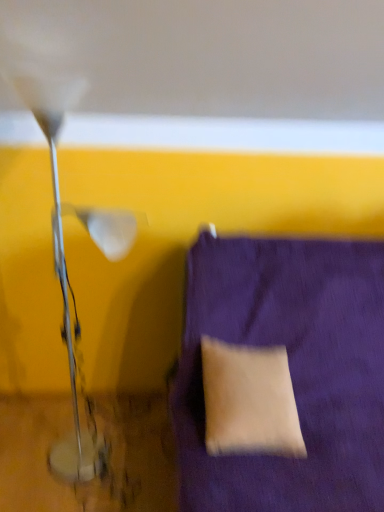
At what (x,y) coordinates should I click in order to perform the action: click on beige fabric pillow at lower right. Please return your answer as a coordinate pair (x, y). The image size is (384, 512). Looking at the image, I should click on (249, 401).

Considering their positions, is beige fabric pillow at lower right located in front of or behind purple fabric cushion at lower right?

beige fabric pillow at lower right is positioned farther from the viewer than purple fabric cushion at lower right.

Does point (225, 393) appear closer or farther from the camera than point (308, 408)?

Point (225, 393).

Which of these two, beige fabric pillow at lower right or purple fabric cushion at lower right, is smaller?

Smaller between the two is beige fabric pillow at lower right.

Between purple fabric cushion at lower right and beige fabric pillow at lower right, which one has smaller width?

beige fabric pillow at lower right.

Image resolution: width=384 pixels, height=512 pixels. Identify the location of furniture on the right of the beige fabric pillow at lower right. (290, 371).

Is purple fabric cushion at lower right bigger than beige fabric pillow at lower right?

Indeed, purple fabric cushion at lower right has a larger size compared to beige fabric pillow at lower right.

In the scene shown: From the image's perspective, which object appears higher, purple fabric cushion at lower right or beige fabric pillow at lower right?

beige fabric pillow at lower right, from the image's perspective.

From the picture: How much distance is there between purple fabric cushion at lower right and metallic silver lamp at left?

A distance of 28.29 inches exists between purple fabric cushion at lower right and metallic silver lamp at left.

Do you think purple fabric cushion at lower right is within metallic silver lamp at left, or outside of it?

purple fabric cushion at lower right is not inside metallic silver lamp at left, it's outside.

You are a GUI agent. You are given a task and a screenshot of the screen. Output one action in this format:
    pyautogui.click(x=<x>, y=<y>)
    Task: Click on the lamp located behind the purple fabric cushion at lower right
    Image resolution: width=384 pixels, height=512 pixels.
    Given the screenshot: What is the action you would take?
    pyautogui.click(x=58, y=178)

Consider the image. From the image's perspective, is purple fabric cushion at lower right above metallic silver lamp at left?

No, from the image's perspective, purple fabric cushion at lower right is not above metallic silver lamp at left.

From a real-world perspective, is metallic silver lamp at left positioned above or below purple fabric cushion at lower right?

Clearly, from a real-world perspective, metallic silver lamp at left is above purple fabric cushion at lower right.

Consider the image. Which of these two, metallic silver lamp at left or purple fabric cushion at lower right, is thinner?

With smaller width is metallic silver lamp at left.

How different are the orientations of metallic silver lamp at left and purple fabric cushion at lower right in degrees?

0.32 degrees.

Which is more to the right, metallic silver lamp at left or purple fabric cushion at lower right?

purple fabric cushion at lower right is more to the right.

In the scene shown: Does metallic silver lamp at left have a greater width compared to beige fabric pillow at lower right?

Correct, the width of metallic silver lamp at left exceeds that of beige fabric pillow at lower right.

Is metallic silver lamp at left positioned far away from beige fabric pillow at lower right?

No, metallic silver lamp at left is not far away from beige fabric pillow at lower right.

Is metallic silver lamp at left looking in the opposite direction of beige fabric pillow at lower right?

No, metallic silver lamp at left is not facing the opposite direction of beige fabric pillow at lower right.

Which is farther from the camera, (71, 442) or (268, 369)?

The point (71, 442) is behind.

Looking at their sizes, would you say beige fabric pillow at lower right is wider or thinner than metallic silver lamp at left?

beige fabric pillow at lower right is thinner than metallic silver lamp at left.

From the image's perspective, does beige fabric pillow at lower right appear lower than metallic silver lamp at left?

Correct, beige fabric pillow at lower right appears lower than metallic silver lamp at left in the image.

Do you think beige fabric pillow at lower right is within metallic silver lamp at left, or outside of it?

beige fabric pillow at lower right cannot be found inside metallic silver lamp at left.

Between beige fabric pillow at lower right and metallic silver lamp at left, which one has more height?

Standing taller between the two is metallic silver lamp at left.

Where is `pillow that is above the purple fabric cushion at lower right (from the image's perspective)`? pillow that is above the purple fabric cushion at lower right (from the image's perspective) is located at coordinates (249, 401).

Locate an element on the screen. This screenshot has height=512, width=384. pillow on the left of purple fabric cushion at lower right is located at coordinates (249, 401).

Estimate the real-world distances between objects in this image. Which object is further from metallic silver lamp at left, beige fabric pillow at lower right or purple fabric cushion at lower right?

purple fabric cushion at lower right is positioned further to the anchor metallic silver lamp at left.

Which object lies nearer to the anchor point beige fabric pillow at lower right, purple fabric cushion at lower right or metallic silver lamp at left?

The object closer to beige fabric pillow at lower right is purple fabric cushion at lower right.

Considering their positions, is metallic silver lamp at left positioned closer to beige fabric pillow at lower right than purple fabric cushion at lower right?

Among the two, purple fabric cushion at lower right is located nearer to beige fabric pillow at lower right.

Based on their spatial positions, is purple fabric cushion at lower right or beige fabric pillow at lower right further from metallic silver lamp at left?

Based on the image, purple fabric cushion at lower right appears to be further to metallic silver lamp at left.

Based on their spatial positions, is beige fabric pillow at lower right or metallic silver lamp at left further from purple fabric cushion at lower right?

The object further to purple fabric cushion at lower right is metallic silver lamp at left.

Estimate the real-world distances between objects in this image. Which object is further from purple fabric cushion at lower right, metallic silver lamp at left or beige fabric pillow at lower right?

Based on the image, metallic silver lamp at left appears to be further to purple fabric cushion at lower right.

Locate an element on the screen. The height and width of the screenshot is (512, 384). pillow situated between metallic silver lamp at left and purple fabric cushion at lower right from left to right is located at coordinates (249, 401).